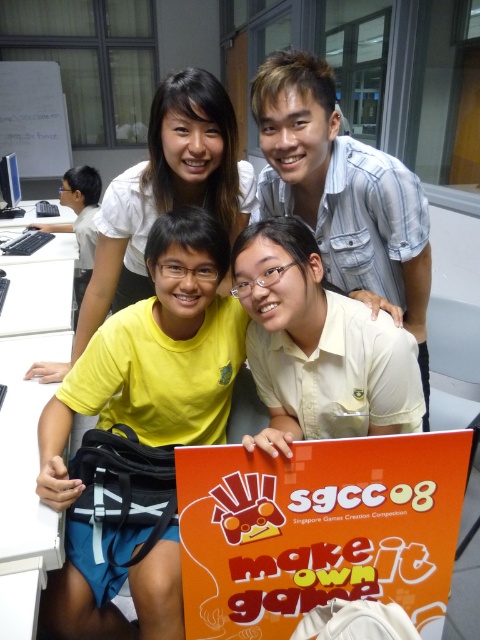
Is yellow fabric shirt at lower left below white plastic table at lower left?

No.

Is point (172, 600) positioned before point (19, 484)?

That is True.

Locate an element on the screen. Image resolution: width=480 pixels, height=640 pixels. yellow fabric shirt at lower left is located at coordinates (156, 355).

Who is shorter, yellow fabric shirt at lower left or white plastic table at left?

white plastic table at left is shorter.

Which is behind, point (100, 419) or point (64, 312)?

Point (64, 312)

Find the location of a particular element. The image size is (480, 640). yellow fabric shirt at lower left is located at coordinates (156, 355).

At what (x,y) coordinates should I click in order to perform the action: click on white plastic table at lower left. Please return your answer as a coordinate pair (x, y). Looking at the image, I should click on (24, 486).

Can you confirm if white plastic table at lower left is positioned above white plastic table at left?

No.

Who is more forward, (23, 364) or (72, 273)?

Positioned in front is point (23, 364).

Image resolution: width=480 pixels, height=640 pixels. In order to click on white plastic table at lower left in this screenshot , I will do `click(24, 486)`.